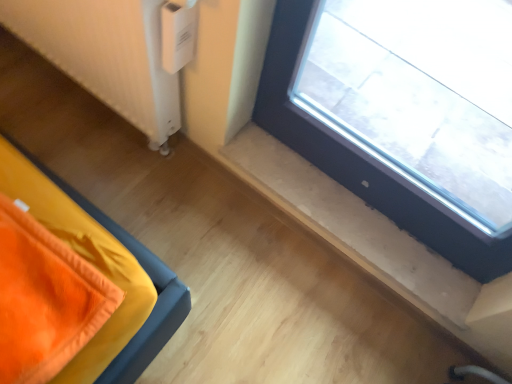
Question: In the image, is transparent glass window at upper right on the left side or the right side of white plastic radiator at lower left?

Choices:
 (A) right
 (B) left

Answer: (A)

Question: In terms of height, does transparent glass window at upper right look taller or shorter compared to white plastic radiator at lower left?

Choices:
 (A) short
 (B) tall

Answer: (B)

Question: Would you say transparent glass window at upper right is inside or outside white plastic radiator at lower left?

Choices:
 (A) inside
 (B) outside

Answer: (B)

Question: In terms of height, does white plastic radiator at lower left look taller or shorter compared to transparent glass window at upper right?

Choices:
 (A) tall
 (B) short

Answer: (B)

Question: Is white plastic radiator at lower left to the left or to the right of transparent glass window at upper right in the image?

Choices:
 (A) right
 (B) left

Answer: (B)

Question: In terms of width, does white plastic radiator at lower left look wider or thinner when compared to transparent glass window at upper right?

Choices:
 (A) wide
 (B) thin

Answer: (A)

Question: Considering the positions of point (140, 122) and point (501, 238), is point (140, 122) closer or farther from the camera than point (501, 238)?

Choices:
 (A) closer
 (B) farther

Answer: (B)